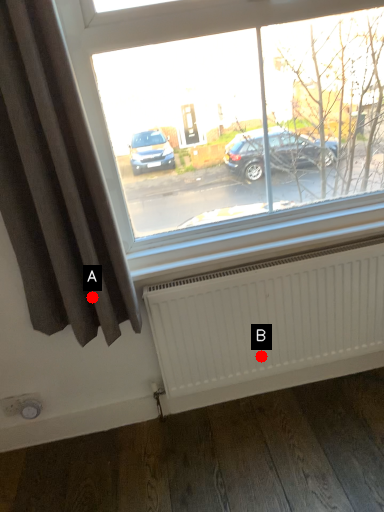
Question: Two points are circled on the image, labeled by A and B beside each circle. Among these points, which one is farthest from the camera?

Choices:
 (A) A is further
 (B) B is further

Answer: (B)